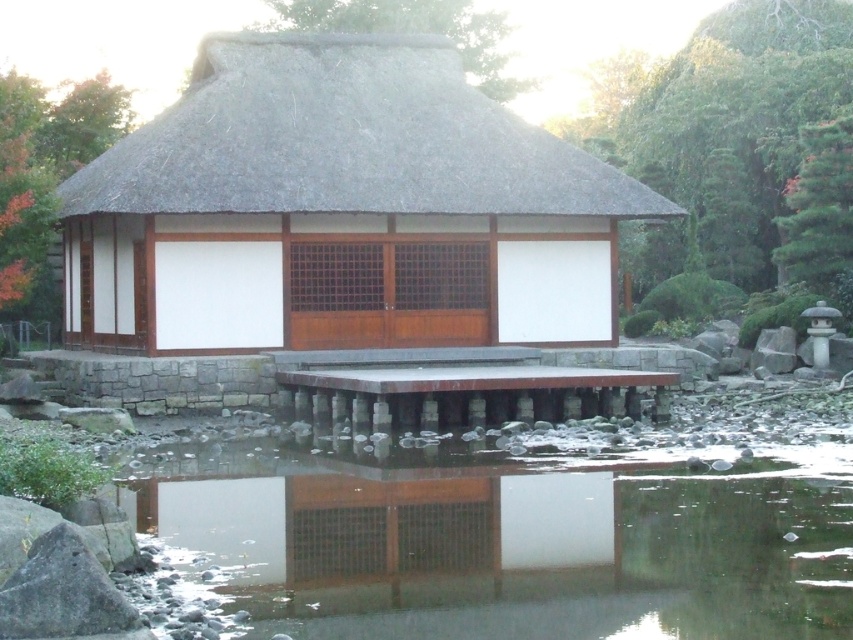
How far apart are transparent glass water at lower center and thatched roof at center?

transparent glass water at lower center and thatched roof at center are 41.04 feet apart.

Does transparent glass water at lower center have a lesser width compared to thatched roof at center?

Yes.

At what (x,y) coordinates should I click in order to perform the action: click on transparent glass water at lower center. Please return your answer as a coordinate pair (x, y). Looking at the image, I should click on (512, 547).